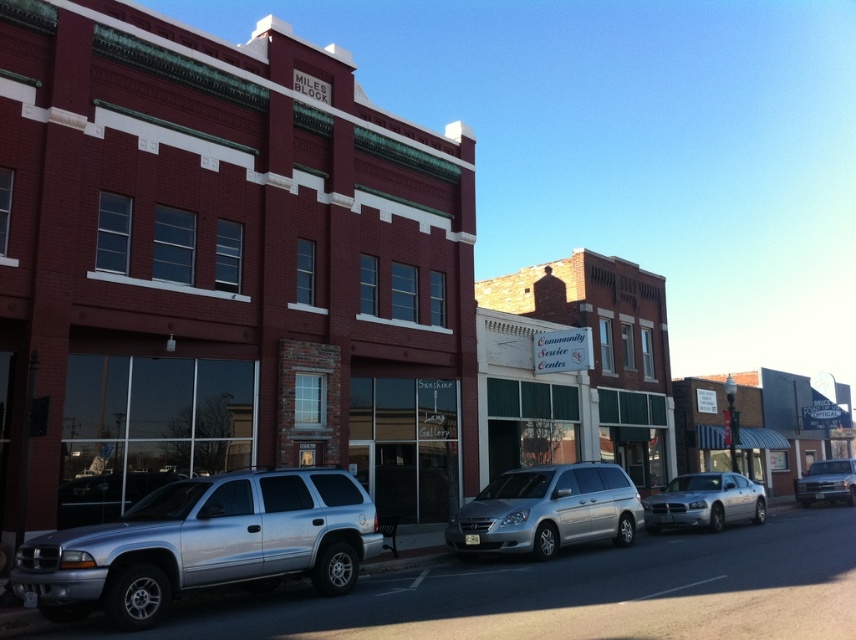
Question: Can you confirm if silver metallic sedan at center is positioned below silver metallic truck at right?

Choices:
 (A) yes
 (B) no

Answer: (B)

Question: Among these objects, which one is nearest to the camera?

Choices:
 (A) silver metallic suv at left
 (B) silver metallic sedan at center
 (C) silver metallic minivan at center
 (D) silver metallic truck at right

Answer: (A)

Question: Which point appears closest to the camera in this image?

Choices:
 (A) (739, 497)
 (B) (150, 532)
 (C) (491, 548)

Answer: (B)

Question: Among these objects, which one is farthest from the camera?

Choices:
 (A) silver metallic sedan at center
 (B) silver metallic minivan at center
 (C) silver metallic suv at left

Answer: (A)

Question: Does silver metallic suv at left have a greater width compared to silver metallic minivan at center?

Choices:
 (A) no
 (B) yes

Answer: (B)

Question: From the image, what is the correct spatial relationship of silver metallic minivan at center in relation to silver metallic truck at right?

Choices:
 (A) right
 (B) left

Answer: (B)